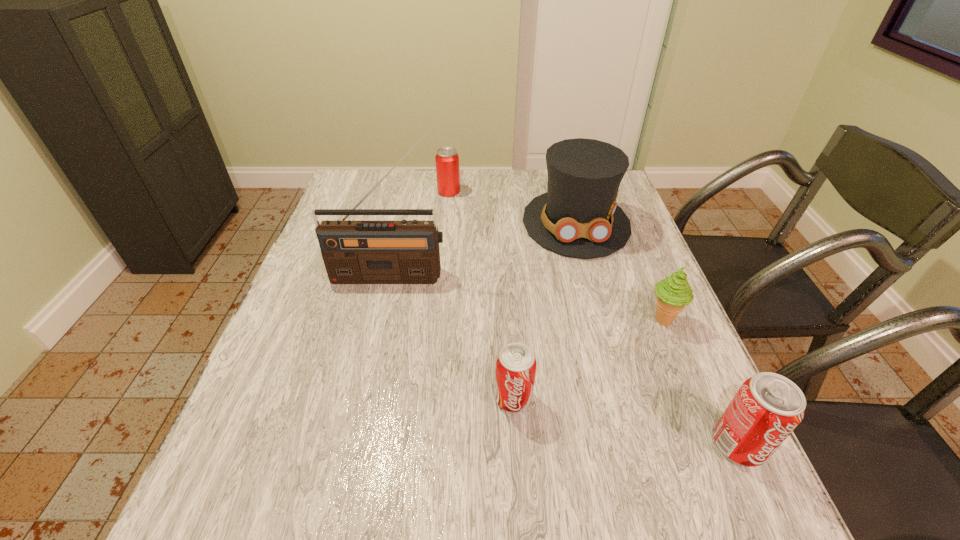
Where is `free spot between the shorter soda can and the dress hat`? The width and height of the screenshot is (960, 540). free spot between the shorter soda can and the dress hat is located at coordinates (544, 310).

Where is `empty space between the dress hat and the taller soda can`? The image size is (960, 540). empty space between the dress hat and the taller soda can is located at coordinates (658, 334).

The height and width of the screenshot is (540, 960). What are the coordinates of `empty location between the dress hat and the radio receiver` in the screenshot? It's located at (484, 249).

The height and width of the screenshot is (540, 960). In order to click on vacant space that's between the farther soda can and the fourth farthest object in this screenshot , I will do `click(588, 359)`.

The width and height of the screenshot is (960, 540). Find the location of `free space that is in between the nearer soda can and the fifth shortest object`. free space that is in between the nearer soda can and the fifth shortest object is located at coordinates (658, 334).

You are a GUI agent. You are given a task and a screenshot of the screen. Output one action in this format:
    pyautogui.click(x=<x>, y=<y>)
    Task: Click on the vacant space in between the second nearest object and the second tallest object
    Image resolution: width=960 pixels, height=540 pixels.
    Given the screenshot: What is the action you would take?
    pyautogui.click(x=544, y=310)

Locate an element on the screen. free spot between the nearer soda can and the icecream is located at coordinates (701, 382).

Locate an element on the screen. This screenshot has height=540, width=960. object that can be found as the closest to the can is located at coordinates tap(578, 216).

This screenshot has height=540, width=960. Identify the location of object that ranks as the fourth closest to the dress hat. (516, 364).

I want to click on vacant position in the image that satisfies the following two spatial constraints: 1. with goggles on the front of the dress hat; 2. on the left side of the icecream, so click(x=603, y=320).